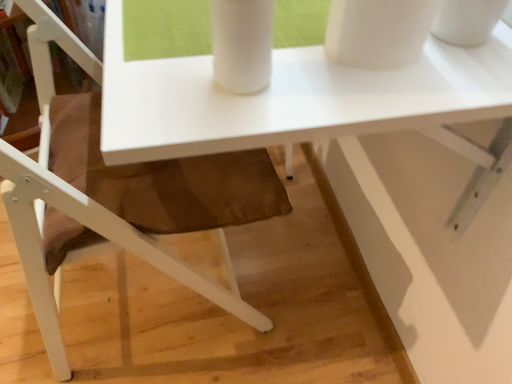
The width and height of the screenshot is (512, 384). I want to click on white matte chair at lower left, so click(106, 208).

What do you see at coordinates (106, 208) in the screenshot? This screenshot has width=512, height=384. I see `white matte chair at lower left` at bounding box center [106, 208].

Locate an element on the screen. The width and height of the screenshot is (512, 384). white matte chair at lower left is located at coordinates (106, 208).